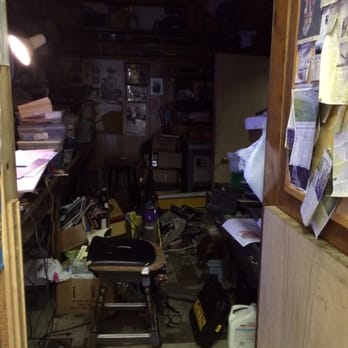
At what (x,y) coordinates should I click in order to perform the action: click on book. Please return your answer as a coordinate pair (x, y). The image size is (348, 348). Looking at the image, I should click on (31, 116).